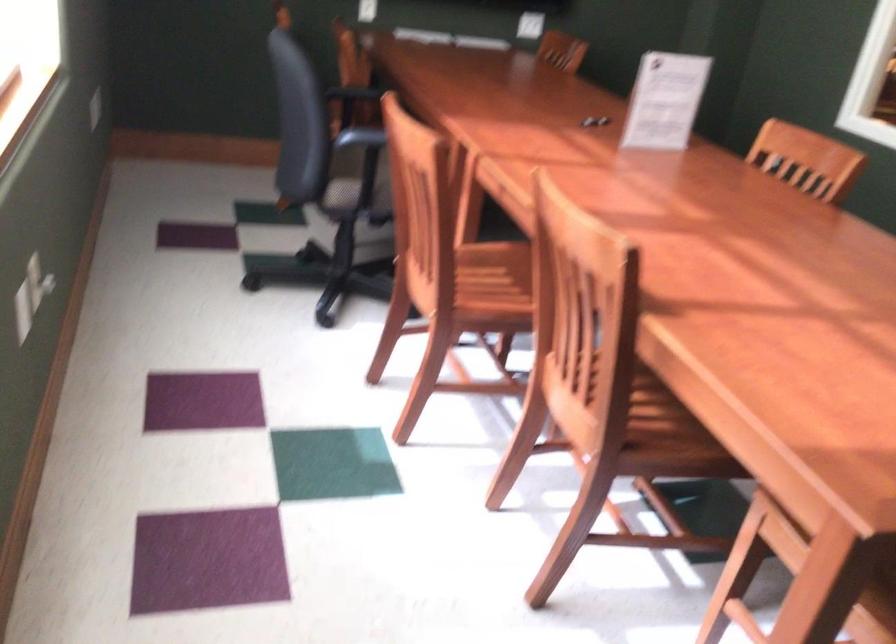
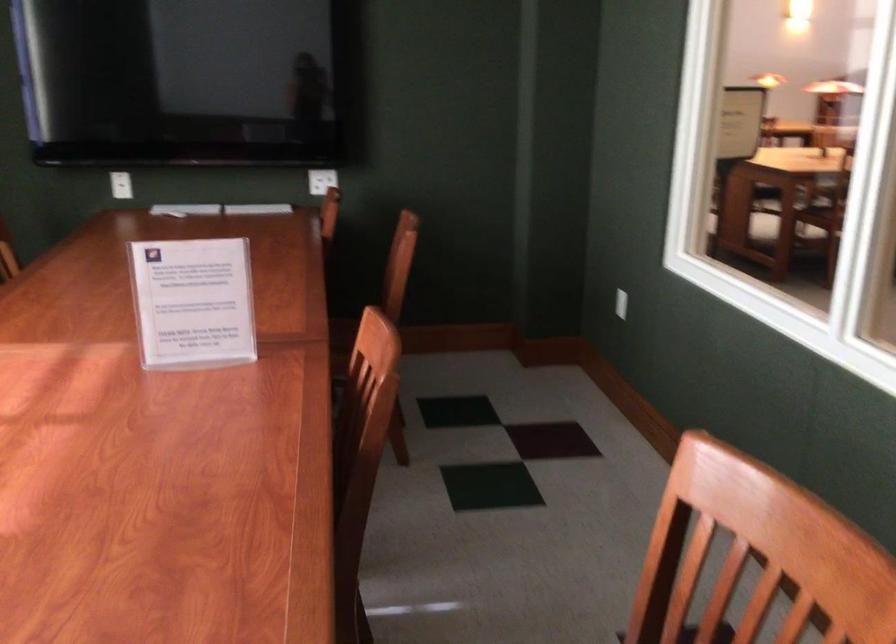
Locate, in the second image, the point that corresponds to point (652, 93) in the first image.

(193, 303)